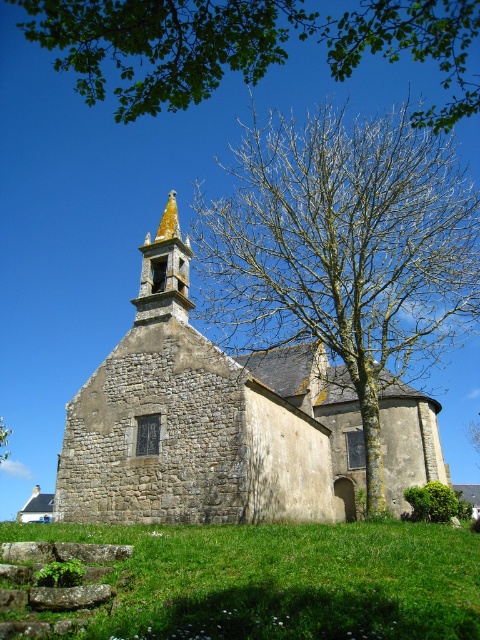
Which is more to the right, green grass at lower center or green leafy tree at lower left?

From the viewer's perspective, green grass at lower center appears more on the right side.

Is point (279, 593) positioned behind point (7, 429)?

No, (279, 593) is closer to viewer.

Is point (169, 634) positioned after point (9, 452)?

No, it is in front of (9, 452).

Find the location of a particular element. green grass at lower center is located at coordinates (286, 579).

Who is taller, green grass at lower center or green leafy tree at upper center?

With more height is green leafy tree at upper center.

Locate an element on the screen. The width and height of the screenshot is (480, 640). green grass at lower center is located at coordinates (286, 579).

Is point (257, 637) closer to viewer compared to point (233, 64)?

Yes, point (257, 637) is closer to viewer.

The image size is (480, 640). Identify the location of green grass at lower center. (286, 579).

Does bare branches at center come behind golden stone spire at upper center?

No.

Based on the photo, between bare branches at center and golden stone spire at upper center, which one has more height?

bare branches at center is taller.

What do you see at coordinates (344, 250) in the screenshot?
I see `bare branches at center` at bounding box center [344, 250].

Locate an element on the screen. bare branches at center is located at coordinates tap(344, 250).